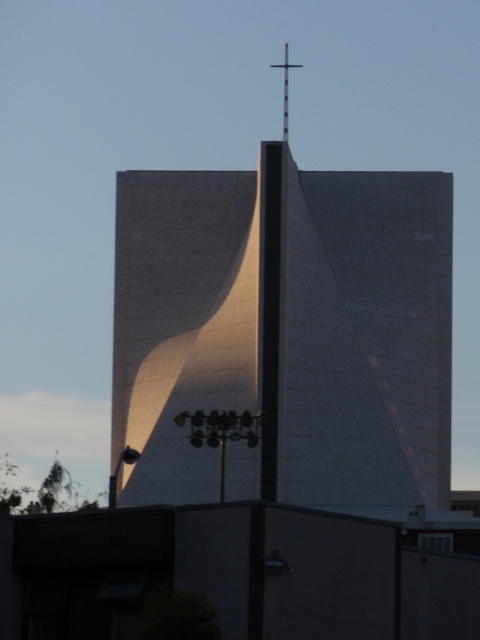
Who is taller, white smooth tower at center or black metal cross at upper center?

With more height is white smooth tower at center.

Is white smooth tower at center thinner than black metal cross at upper center?

No.

I want to click on white smooth tower at center, so click(x=285, y=332).